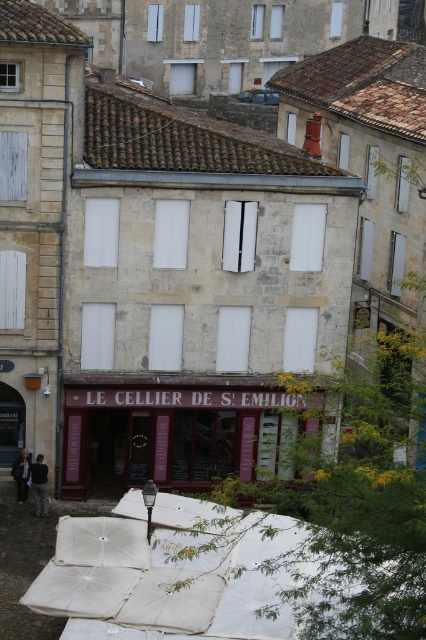
You are standing in front of the traditional European building and notice two jackets hanging on a rack near the entrance. Which jacket is closer to you, the black leather jacket at lower left or the dark gray jacket at lower left?

The black leather jacket at lower left is closer to you because it is in front of the dark gray jacket at lower left.

You are standing in front of the traditional European building and notice two items on the ground. You need to place a rectangular box that is 1 meter wide between them. Can you determine if the space between the beige fabric umbrella at lower center and the black leather jacket at lower left is wide enough?

The beige fabric umbrella at lower center is wider than the black leather jacket at lower left. However, the question asks about the space between them, not their widths. Since the description only provides information about their individual widths and not the distance between them, it is impossible to determine if the 1 meter wide box can fit without knowing the actual spacing between the two objects.